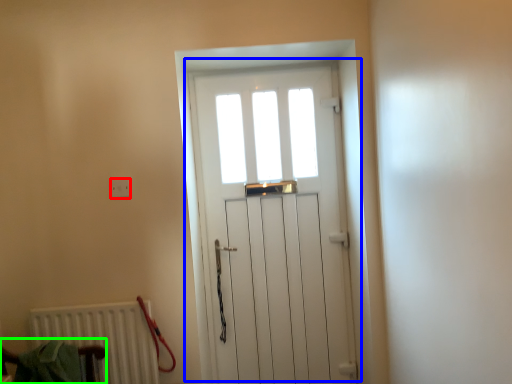
Question: Considering the real-world distances, which object is farthest from electric outlet (highlighted by a red box)? door (highlighted by a blue box) or armchair (highlighted by a green box)?

Choices:
 (A) door
 (B) armchair

Answer: (A)